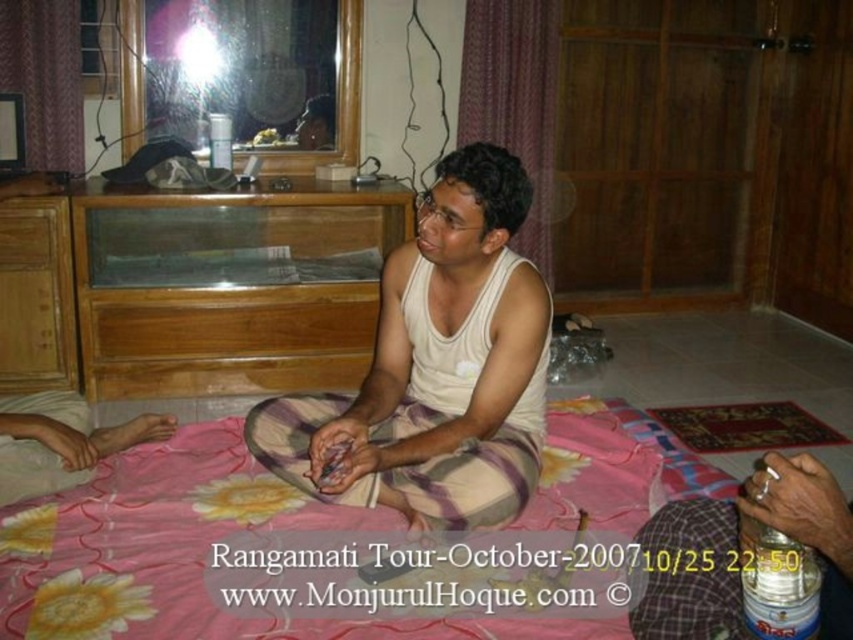
Question: Considering the relative positions of pink floral blanket at center and white cotton tank top at center in the image provided, where is pink floral blanket at center located with respect to white cotton tank top at center?

Choices:
 (A) above
 (B) below

Answer: (B)

Question: Can you confirm if pink floral blanket at center is positioned below white cotton tank top at center?

Choices:
 (A) yes
 (B) no

Answer: (A)

Question: Is pink floral blanket at center smaller than white cotton tank top at center?

Choices:
 (A) no
 (B) yes

Answer: (A)

Question: Which point is farther to the camera?

Choices:
 (A) pink floral blanket at center
 (B) white cotton tank top at center

Answer: (B)

Question: Which point is farther from the camera taking this photo?

Choices:
 (A) (355, 442)
 (B) (20, 550)

Answer: (A)

Question: Which object appears closest to the camera in this image?

Choices:
 (A) pink floral blanket at center
 (B) white cotton tank top at center

Answer: (A)